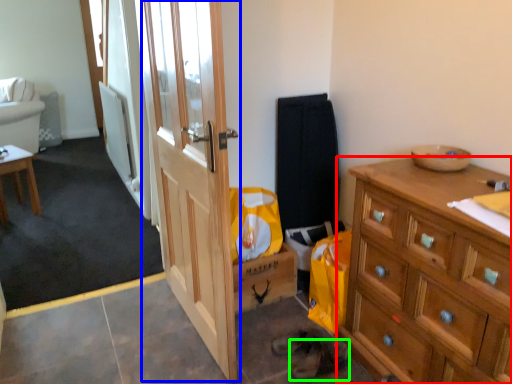
Question: Based on their relative distances, which object is farther from cabinetry (highlighted by a red box)? Choose from door (highlighted by a blue box) and shoe (highlighted by a green box).

Choices:
 (A) door
 (B) shoe

Answer: (A)